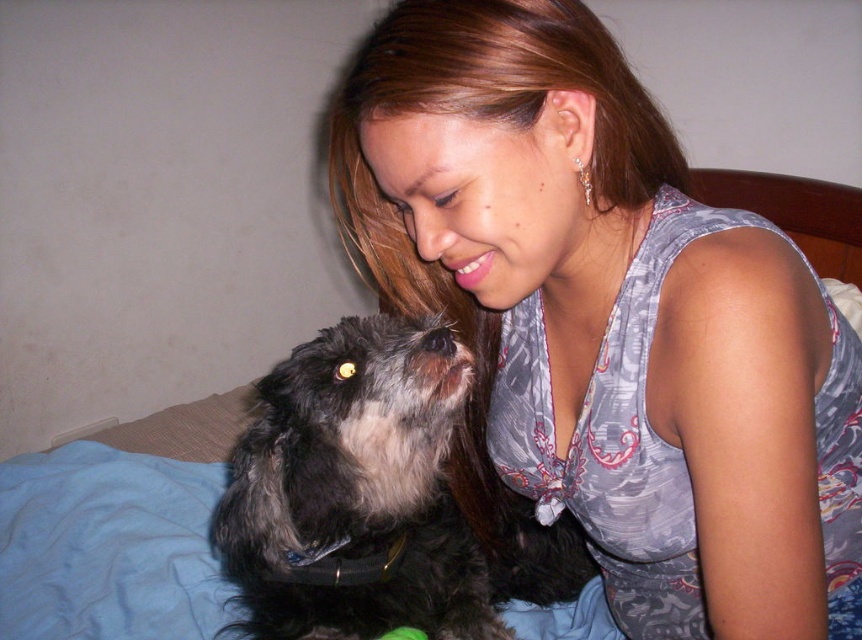
Question: Can you confirm if gray fabric at upper center is positioned to the right of fuzzy black dog at center?

Choices:
 (A) no
 (B) yes

Answer: (B)

Question: Which point is closer to the camera?

Choices:
 (A) (551, 64)
 (B) (236, 540)

Answer: (A)

Question: Does gray fabric at upper center come behind fuzzy black dog at center?

Choices:
 (A) no
 (B) yes

Answer: (A)

Question: In this image, where is gray fabric at upper center located relative to fuzzy black dog at center?

Choices:
 (A) below
 (B) above

Answer: (B)

Question: Among these objects, which one is nearest to the camera?

Choices:
 (A) fuzzy black dog at center
 (B) gray fabric at upper center

Answer: (B)